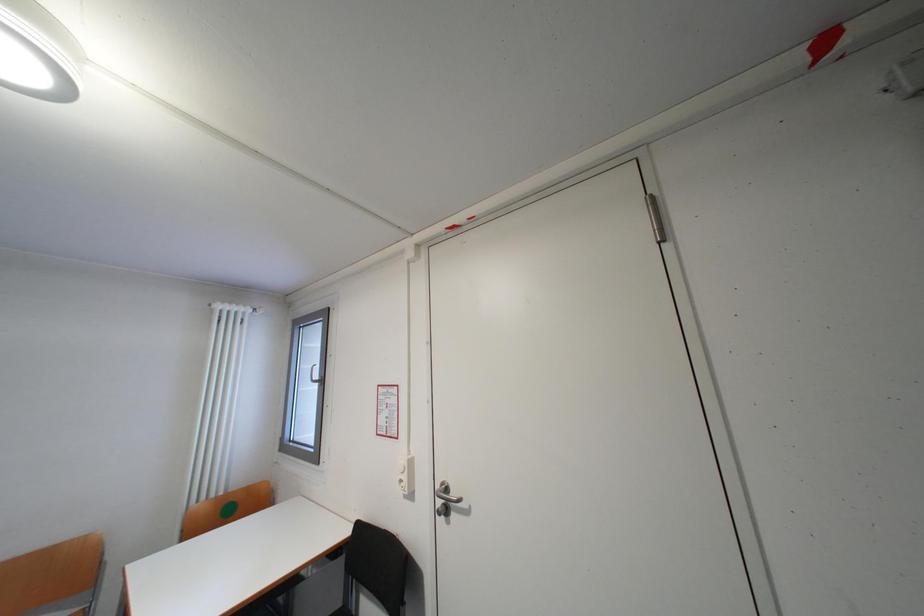
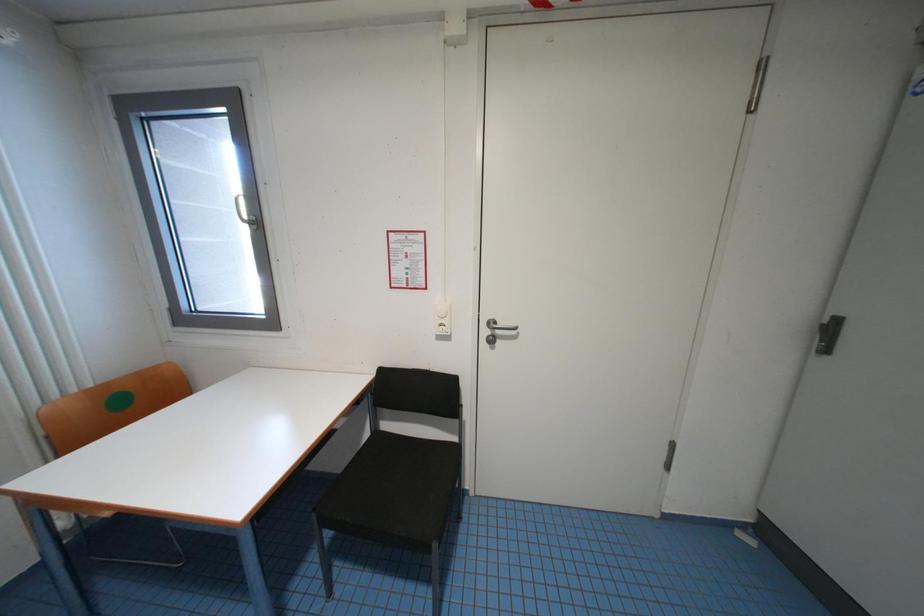
The images are taken continuously from a first-person perspective. In which direction is your viewpoint rotating?

Answer: The camera rotated toward right-down.